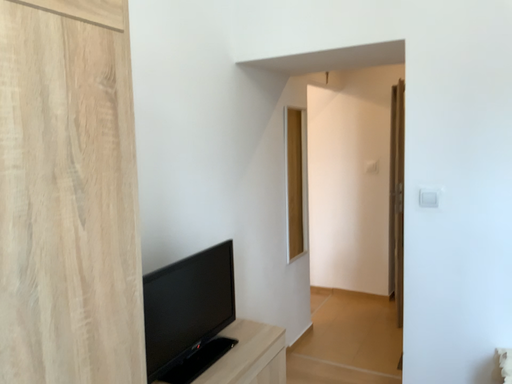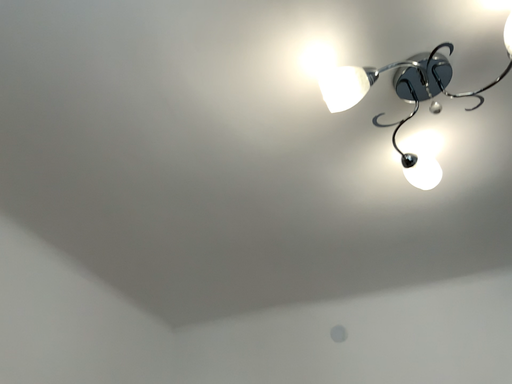
Question: How did the camera likely rotate when shooting the video?

Choices:
 (A) rotated upward
 (B) rotated downward

Answer: (A)